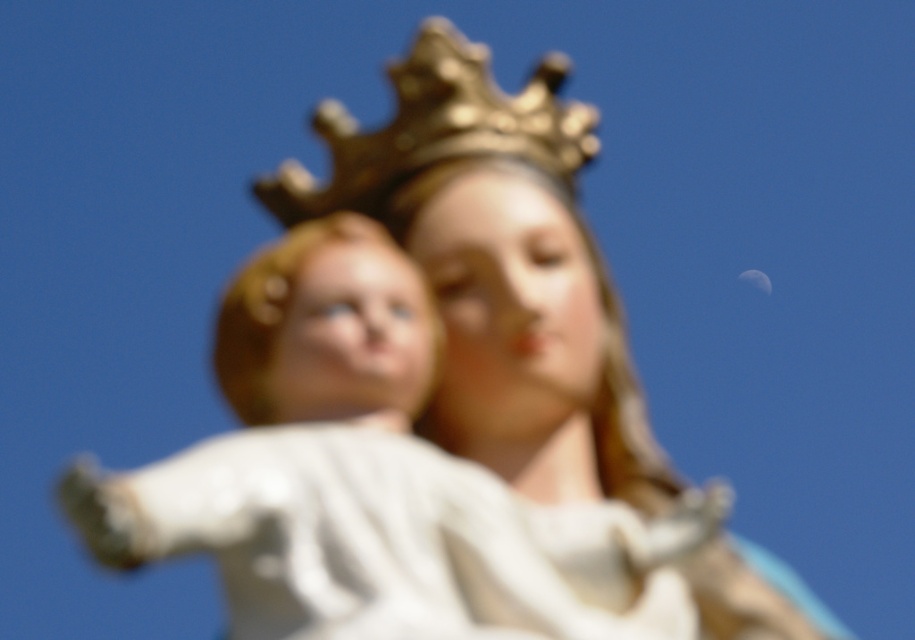
Based on the scene described, can you determine if the white porcelain child at center is wider than the gold metallic crown at upper center?

The white porcelain child at center might be wider than gold metallic crown at upper center according to the description provided.

You are an art conservator examining the statue of the Virgin Mary holding the infant Jesus. The statue is in a gallery with a coordinate system where the bottom left corner is the origin. You need to place a protective barrier around the white porcelain child at center. What are the coordinates of the child to ensure the barrier is correctly positioned?

The white porcelain child at center is located at coordinates point (x=371, y=481), so the protective barrier should be placed around these coordinates to ensure proper protection.